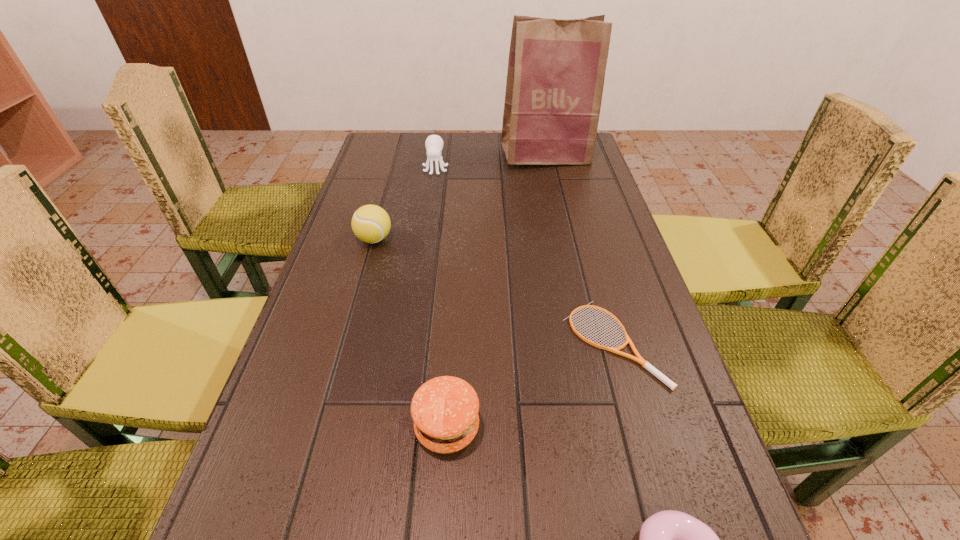
This screenshot has width=960, height=540. Identify the location of free spot that satisfies the following two spatial constraints: 1. on the front-facing side of the octopus; 2. on the right side of the shortest object. (410, 343).